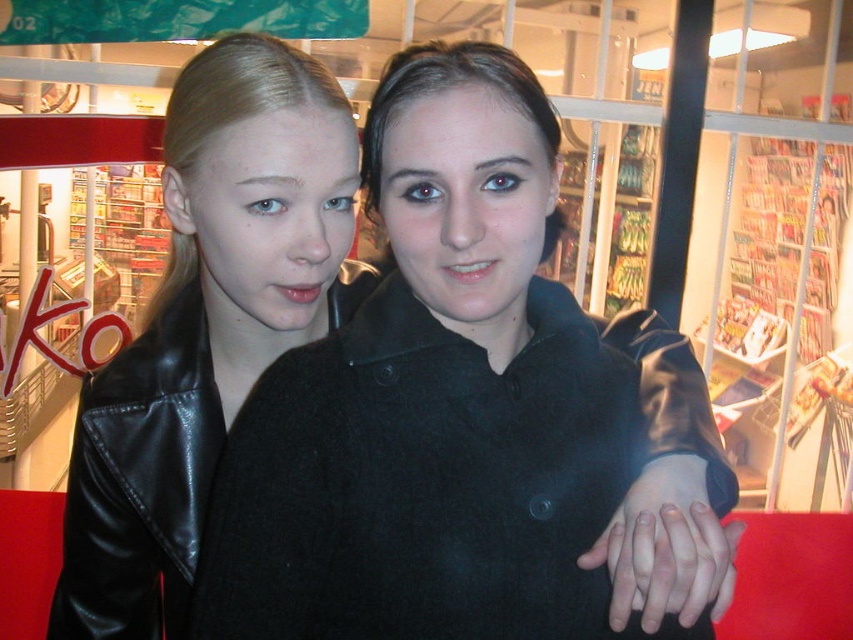
Question: Which point is farther to the camera?

Choices:
 (A) black leather jacket at left
 (B) black leather jacket at center

Answer: (A)

Question: Does black leather jacket at center appear on the right side of black leather jacket at left?

Choices:
 (A) no
 (B) yes

Answer: (B)

Question: Is black leather jacket at center in front of black leather jacket at left?

Choices:
 (A) no
 (B) yes

Answer: (B)

Question: Does black leather jacket at center have a greater width compared to black leather jacket at left?

Choices:
 (A) yes
 (B) no

Answer: (A)

Question: Which point is closer to the camera?

Choices:
 (A) black leather jacket at center
 (B) black leather jacket at left

Answer: (A)